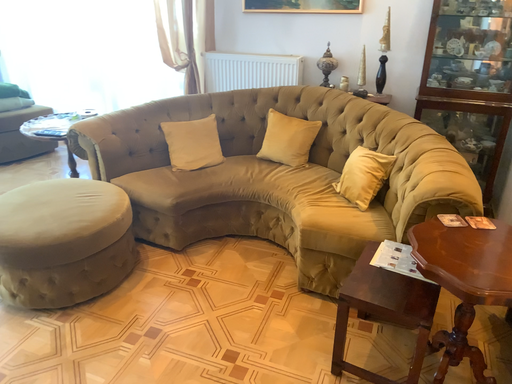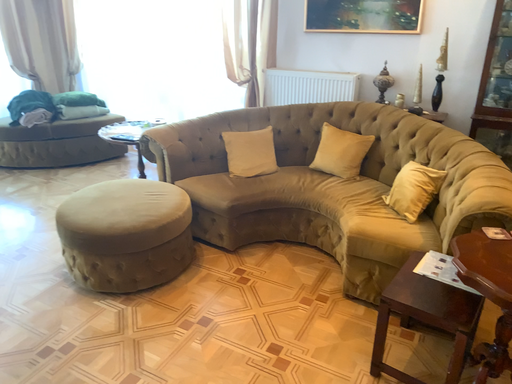
Question: Which way did the camera rotate in the video?

Choices:
 (A) rotated left
 (B) rotated right

Answer: (A)